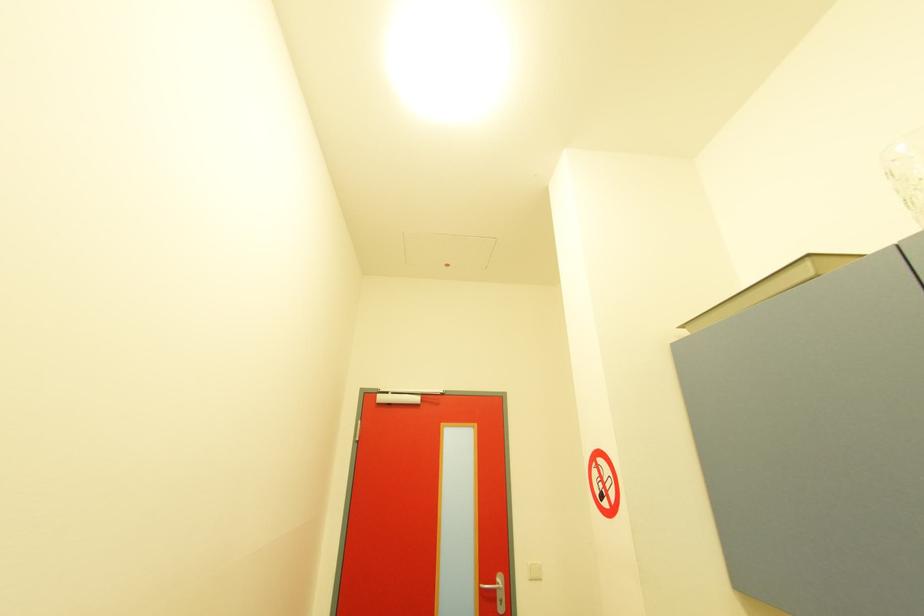
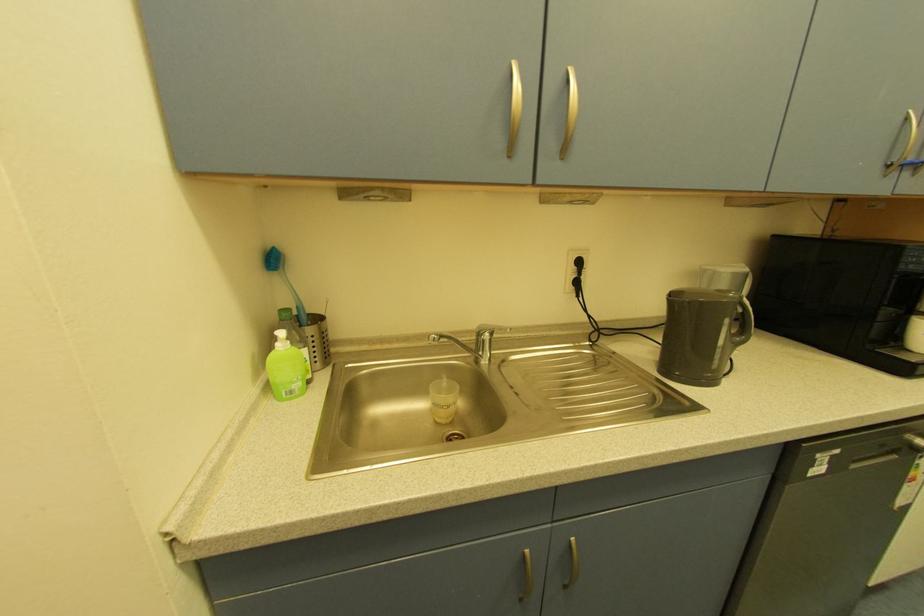
Question: How did the camera likely rotate?

Choices:
 (A) Left
 (B) Right
 (C) Up
 (D) Down

Answer: (B)